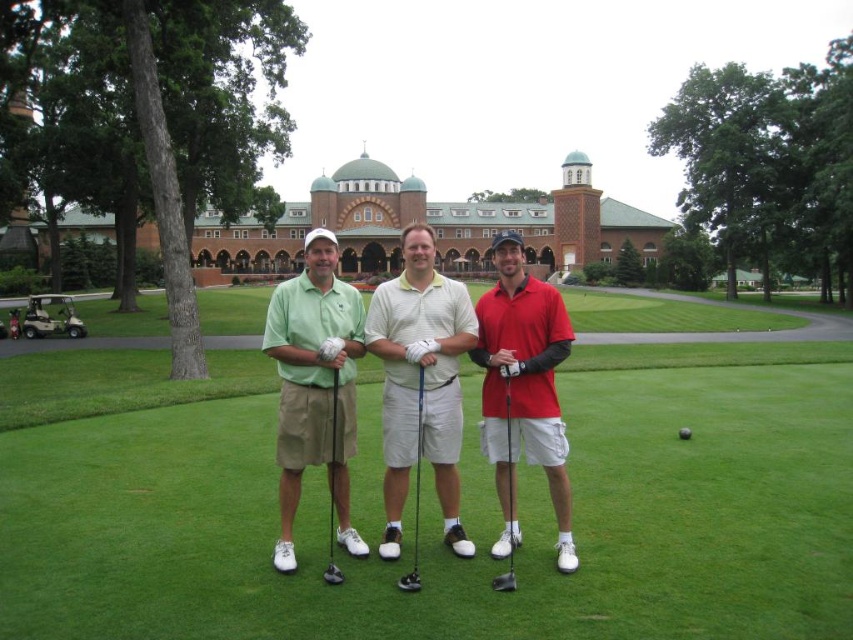
Does matte red polo shirt at center have a larger size compared to metallic silver golf club at center?

Yes.

Which is behind, point (498, 412) or point (509, 426)?

The point (498, 412) is more distant.

What are the coordinates of `matte red polo shirt at center` in the screenshot? It's located at (523, 388).

Image resolution: width=853 pixels, height=640 pixels. What do you see at coordinates (463, 515) in the screenshot?
I see `green grass at center` at bounding box center [463, 515].

At what (x,y) coordinates should I click in order to perform the action: click on green grass at center. Please return your answer as a coordinate pair (x, y). This screenshot has height=640, width=853. Looking at the image, I should click on (463, 515).

Locate an element on the screen. This screenshot has width=853, height=640. matte red polo shirt at center is located at coordinates (523, 388).

Which of these two, matte red polo shirt at center or black rubber golf ball at center, stands taller?

matte red polo shirt at center

Is point (492, 326) behind point (683, 433)?

That is False.

You are a GUI agent. You are given a task and a screenshot of the screen. Output one action in this format:
    pyautogui.click(x=<x>, y=<y>)
    Task: Click on the matte red polo shirt at center
    
    Given the screenshot: What is the action you would take?
    pyautogui.click(x=523, y=388)